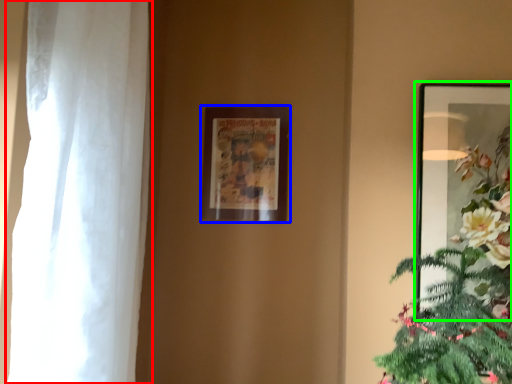
Question: Estimate the real-world distances between objects in this image. Which object is closer to curtain (highlighted by a red box), picture frame (highlighted by a blue box) or picture frame (highlighted by a green box)?

Choices:
 (A) picture frame
 (B) picture frame

Answer: (A)